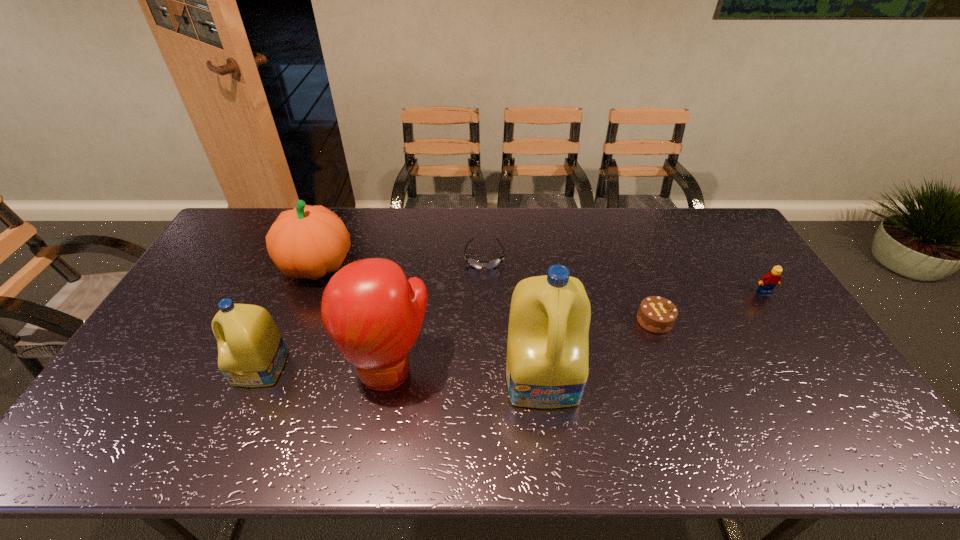
In the image, there is a desktop. Where is `free space at the far edge`? This screenshot has height=540, width=960. free space at the far edge is located at coordinates (498, 228).

In the image, there is a desktop. At what (x,y) coordinates should I click in order to perform the action: click on vacant area at the near edge. Please return your answer as a coordinate pair (x, y). Looking at the image, I should click on (370, 403).

You are a GUI agent. You are given a task and a screenshot of the screen. Output one action in this format:
    pyautogui.click(x=<x>, y=<y>)
    Task: Click on the vacant space at the left edge
    This screenshot has height=540, width=960.
    Given the screenshot: What is the action you would take?
    (x=230, y=295)

In the image, there is a desktop. Where is `vacant space at the near left corner`? The width and height of the screenshot is (960, 540). vacant space at the near left corner is located at coordinates (138, 384).

Identify the location of blank space at the far right corner. This screenshot has width=960, height=540. (692, 217).

At what (x,y) coordinates should I click in order to perform the action: click on free space between the taller detergent and the fifth object from right to left. Please return your answer as a coordinate pair (x, y). Looking at the image, I should click on (467, 374).

Locate an element on the screen. The width and height of the screenshot is (960, 540). unoccupied position between the taller detergent and the third shortest object is located at coordinates (654, 334).

Identify the location of free space that is in between the taller detergent and the sixth tallest object. The image size is (960, 540). (599, 349).

Locate an element on the screen. This screenshot has width=960, height=540. vacant area that lies between the shortest object and the third shortest object is located at coordinates (624, 274).

Find the location of a particular element. The image size is (960, 540). vacant area that lies between the shortest object and the pumpkin is located at coordinates (400, 262).